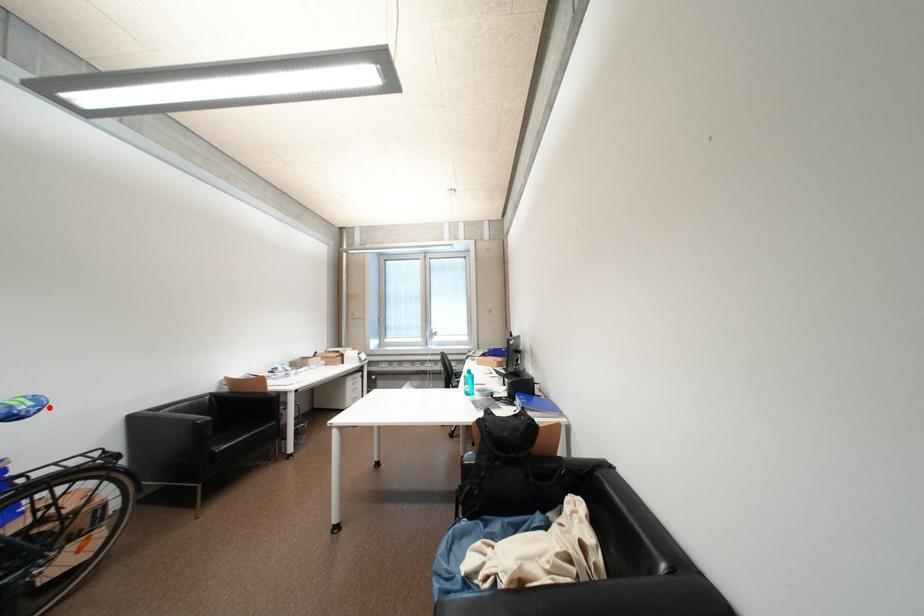
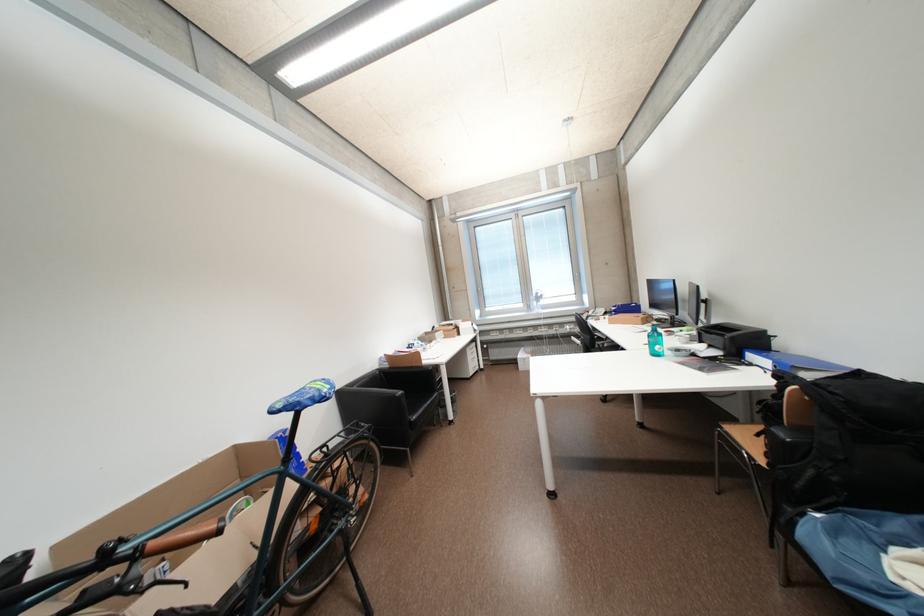
Find the pixel in the second image that matches the highlighted location in the first image.

(341, 390)